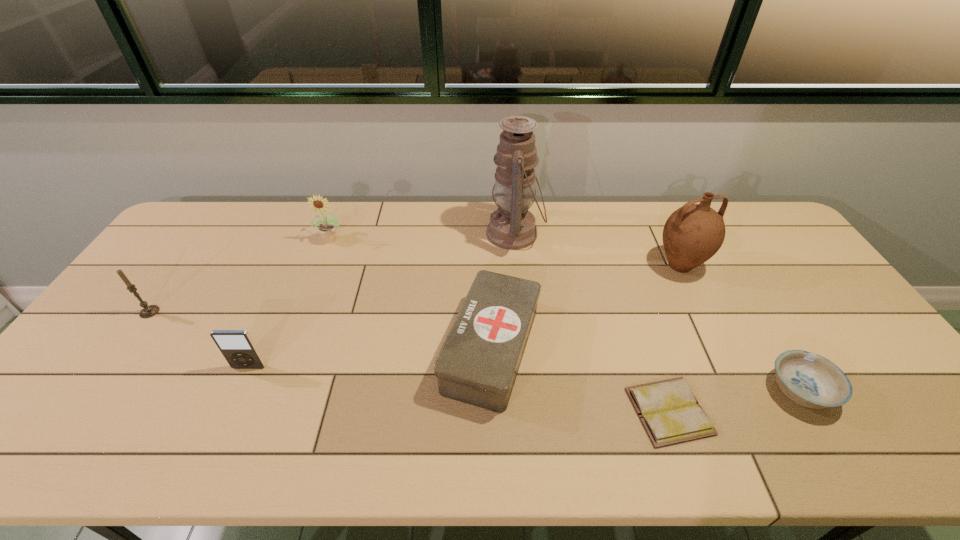
I want to click on free space located 0.130m on the back of the pitcher, so click(x=660, y=225).

Find the location of a particular element. The width and height of the screenshot is (960, 540). vacant area situated 0.370m on the front-facing side of the sunflower is located at coordinates (296, 336).

What are the coordinates of `free space located 0.300m on the back of the leftmost object` in the screenshot? It's located at (202, 240).

The image size is (960, 540). Find the location of `free location located on the front-facing side of the iPod`. free location located on the front-facing side of the iPod is located at coordinates (232, 405).

This screenshot has height=540, width=960. Find the location of `free location located on the right of the sixth tallest object`. free location located on the right of the sixth tallest object is located at coordinates (621, 349).

Where is `free location located on the back of the bowl`? free location located on the back of the bowl is located at coordinates (768, 336).

Locate an element on the screen. This screenshot has width=960, height=540. blank area located 0.400m on the back of the diary is located at coordinates (621, 269).

Locate an element on the screen. Image resolution: width=960 pixels, height=540 pixels. oil lamp that is at the far edge is located at coordinates (512, 226).

At what (x,y) coordinates should I click in order to perform the action: click on sunflower that is at the far edge. Please return your answer as a coordinate pair (x, y). Looking at the image, I should click on (327, 229).

Find the location of a particular element. This screenshot has height=540, width=960. object located at the near edge is located at coordinates (670, 413).